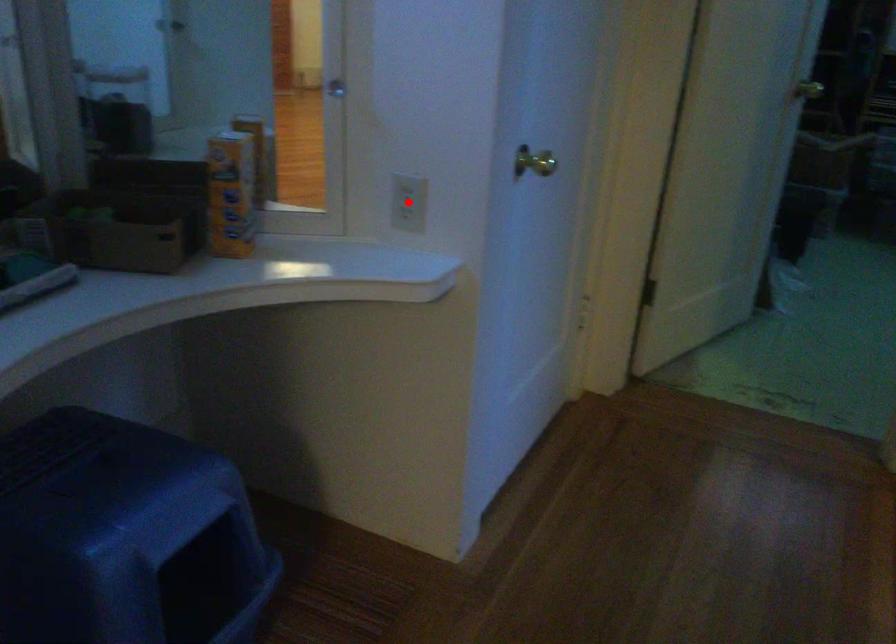
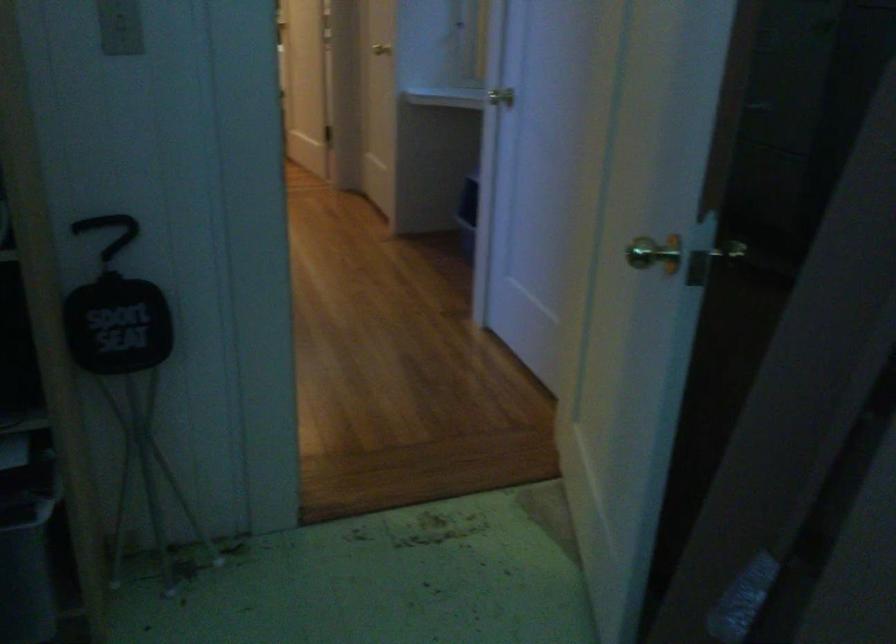
Question: I am providing you with two images of the same scene from different viewpoints. A red point is marked on the first image. Is the red point's position out of view in image 2?

Choices:
 (A) Yes
 (B) No

Answer: (A)